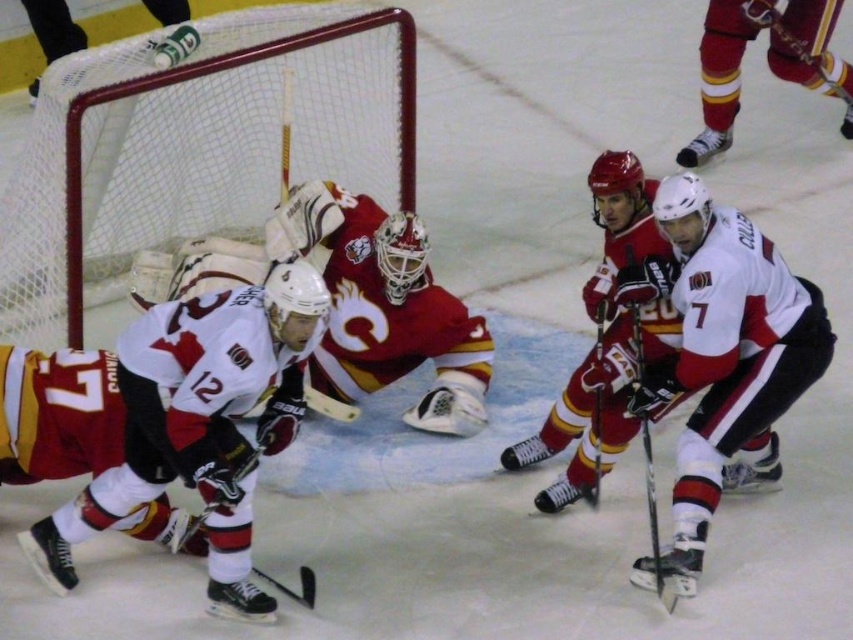
You are a hockey player positioned at the center of the ice rink. There are two points marked on the ice at coordinates point (154, 404) and point (660, 577). Which point is nearer to your current position?

Point (154, 404) is closer to the viewer than point (660, 577), so the point (154, 404) is nearer to your current position.

From the picture: You are a hockey player trying to locate your teammate wearing the maroon jersey at center. Where should you look on the ice rink?

The maroon jersey at center is located at point (767,61) on the ice rink.